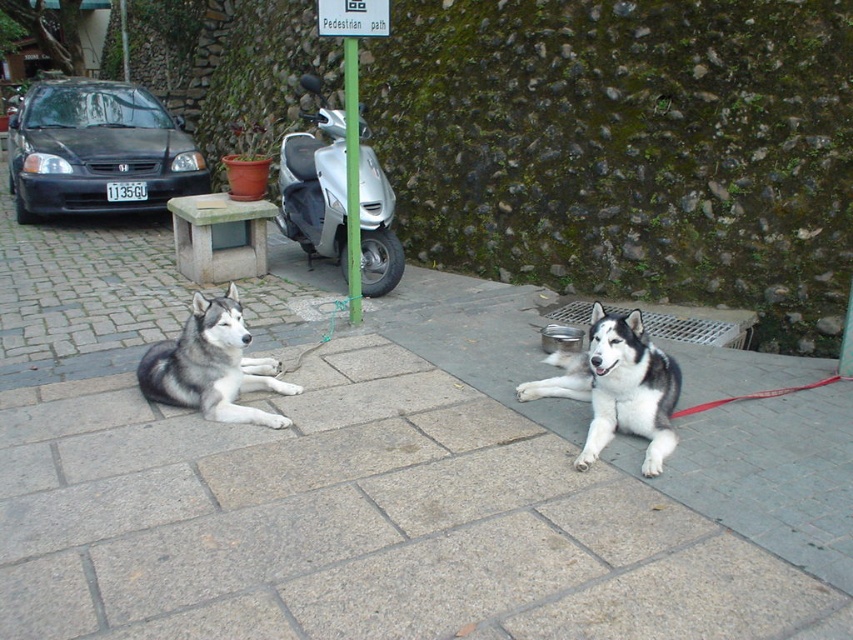
Question: In this image, where is matte black car at left located relative to gray fur husky at center?

Choices:
 (A) above
 (B) below

Answer: (A)

Question: In this image, where is gray stone pavement at center located relative to silver metallic scooter at center?

Choices:
 (A) right
 (B) left

Answer: (A)

Question: Can you confirm if matte black car at left is positioned above black and white fur dog at center?

Choices:
 (A) no
 (B) yes

Answer: (B)

Question: Which object is farther from the camera taking this photo?

Choices:
 (A) green painted metal pole at center
 (B) gray stone pavement at center
 (C) black and white fur dog at center

Answer: (A)

Question: Which object is the closest to the matte black car at left?

Choices:
 (A) black and white fur dog at center
 (B) gray stone pavement at center

Answer: (A)

Question: Which is farther from the red rubber leash at lower right?

Choices:
 (A) matte black car at left
 (B) green painted metal pole at center
 (C) black and white fur dog at center

Answer: (A)